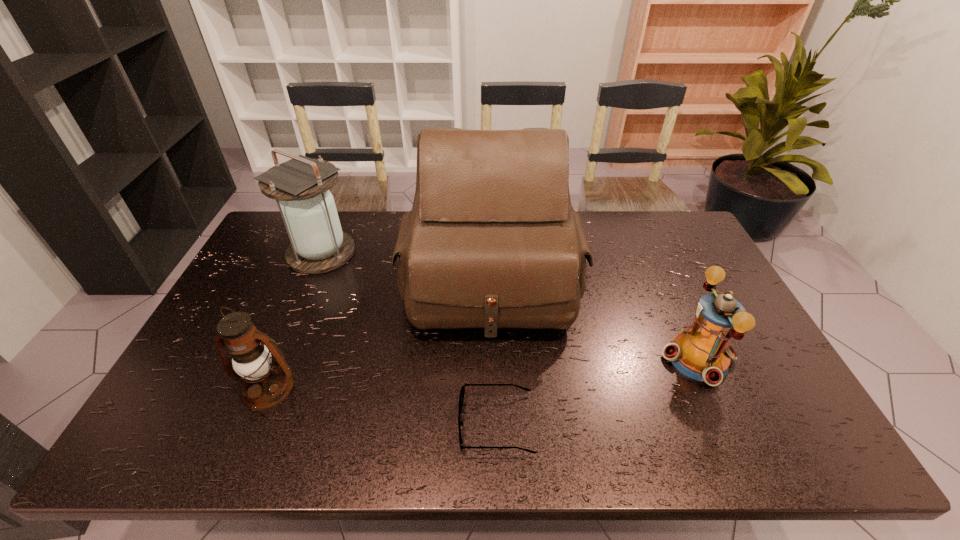
Find the location of a particular element. This screenshot has width=960, height=540. the tallest object is located at coordinates point(491,242).

Identify the location of the tallest lantern. Image resolution: width=960 pixels, height=540 pixels. (318, 245).

This screenshot has width=960, height=540. In order to click on the farthest lantern in this screenshot , I will do pyautogui.click(x=318, y=245).

Where is `the rightmost object`? the rightmost object is located at coordinates (702, 352).

Identify the location of the shortest object. This screenshot has height=540, width=960. (462, 392).

Where is `free space located on the front flap of the tallest object`? The width and height of the screenshot is (960, 540). free space located on the front flap of the tallest object is located at coordinates (494, 413).

This screenshot has width=960, height=540. I want to click on free space located 0.050m on the front of the tallest lantern, so tap(306, 287).

Where is `vacant point located 0.140m on the front-facing side of the rightmost lantern`? The width and height of the screenshot is (960, 540). vacant point located 0.140m on the front-facing side of the rightmost lantern is located at coordinates (609, 358).

Locate an element on the screen. This screenshot has height=540, width=960. vacant space located 0.260m on the front-facing side of the rightmost lantern is located at coordinates (564, 358).

Where is `vacant region located on the front-facing side of the rightmost lantern`? This screenshot has width=960, height=540. vacant region located on the front-facing side of the rightmost lantern is located at coordinates (564, 358).